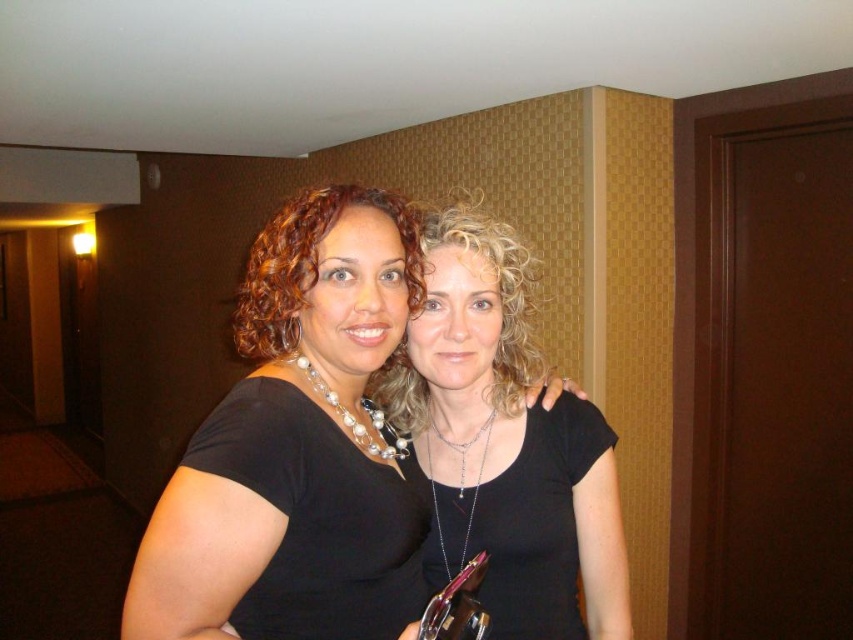
Is point (363, 516) positioned after point (489, 348)?

No.

Between black matte shirt at center and black matte necklace at center, which one appears on the right side from the viewer's perspective?

black matte necklace at center

Which is behind, point (264, 396) or point (541, 493)?

The point (541, 493) is behind.

At what (x,y) coordinates should I click in order to perform the action: click on black matte shirt at center. Please return your answer as a coordinate pair (x, y). The height and width of the screenshot is (640, 853). Looking at the image, I should click on (294, 448).